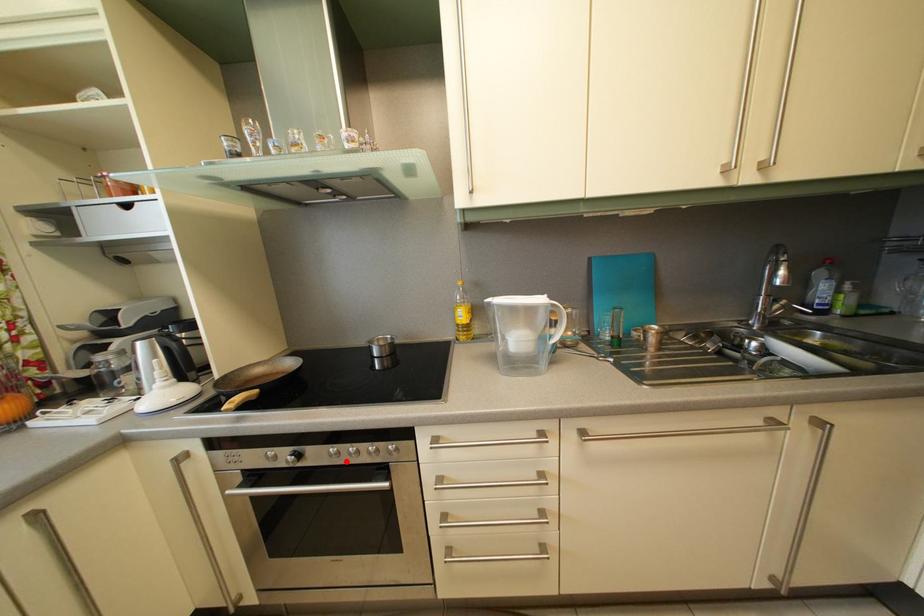
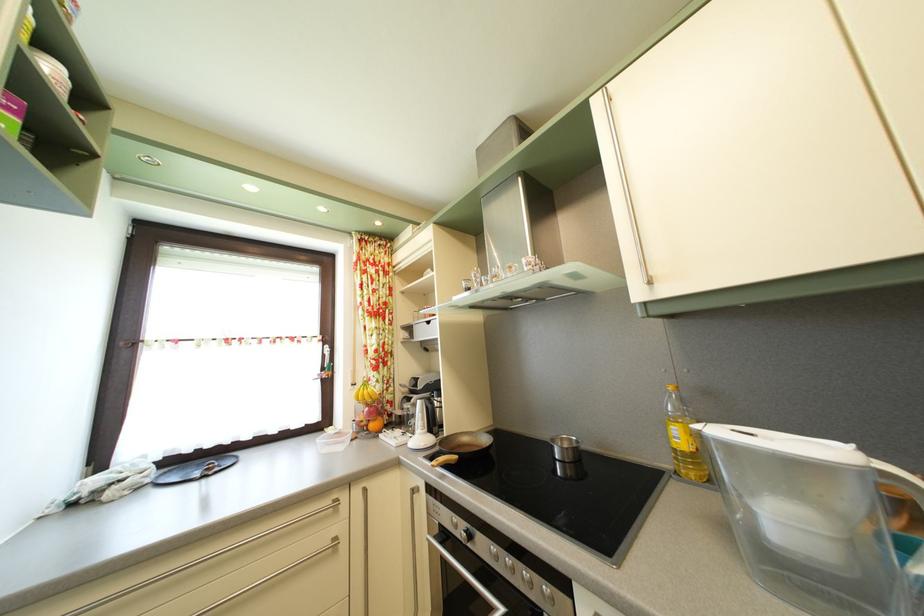
Question: I am providing you with two images of the same scene from different viewpoints. A red point is marked on the first image. Is the red point's position out of view in image 2?

Choices:
 (A) Yes
 (B) No

Answer: (B)